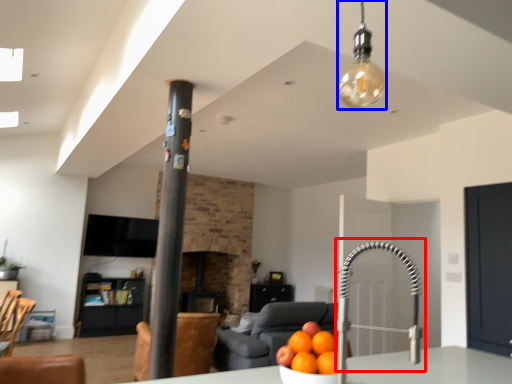
Question: Which point is further to the camera, faucet (highlighted by a red box) or light fixture (highlighted by a blue box)?

Choices:
 (A) faucet
 (B) light fixture

Answer: (B)